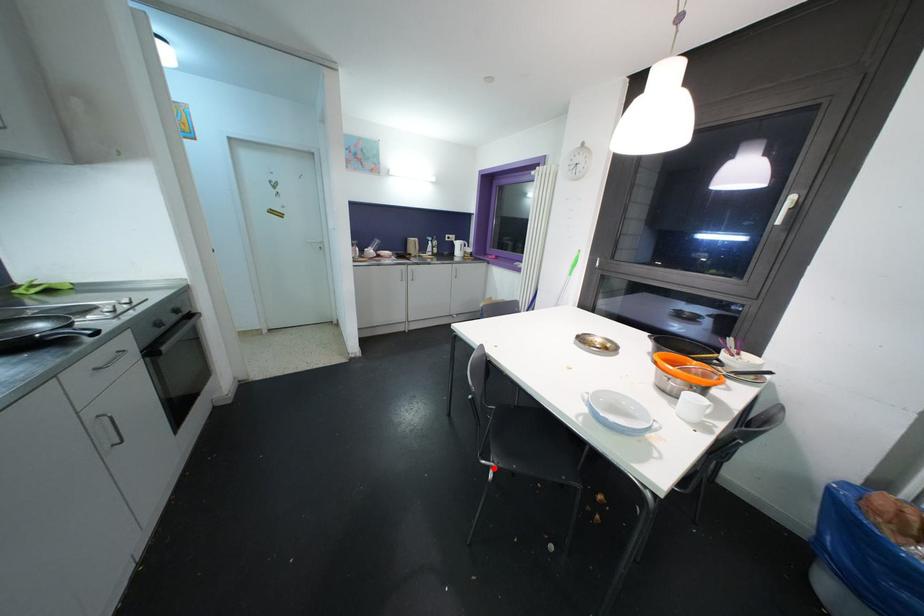
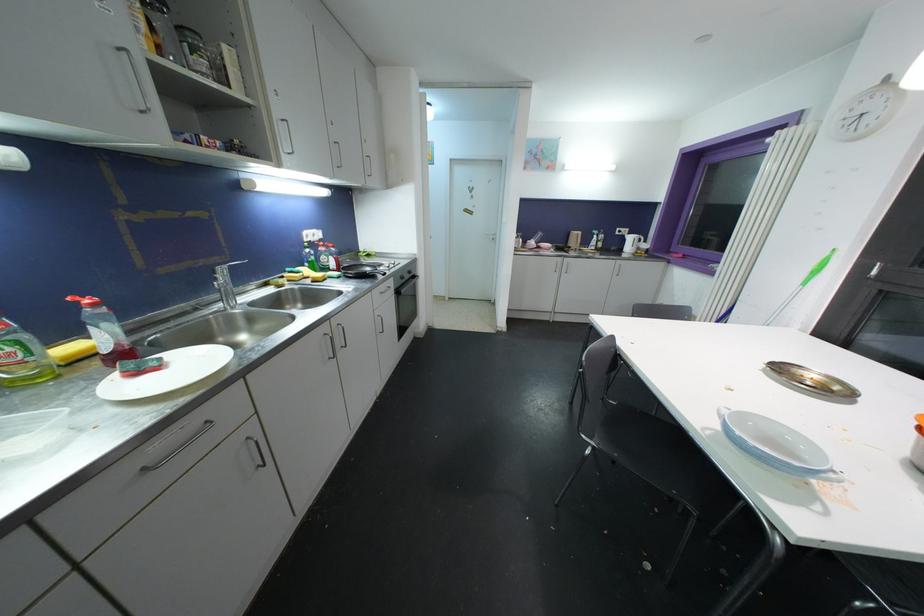
Question: I am providing you with two images of the same scene from different viewpoints. A red point is shown in image1. For the corresponding object point in image2, is it positioned nearer or farther from the camera?

Choices:
 (A) Nearer
 (B) Farther

Answer: (A)